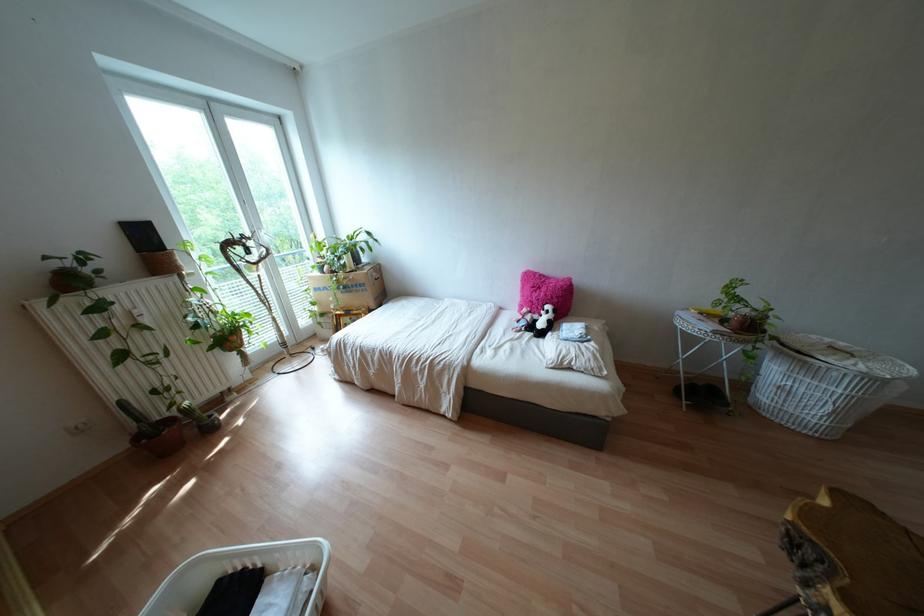
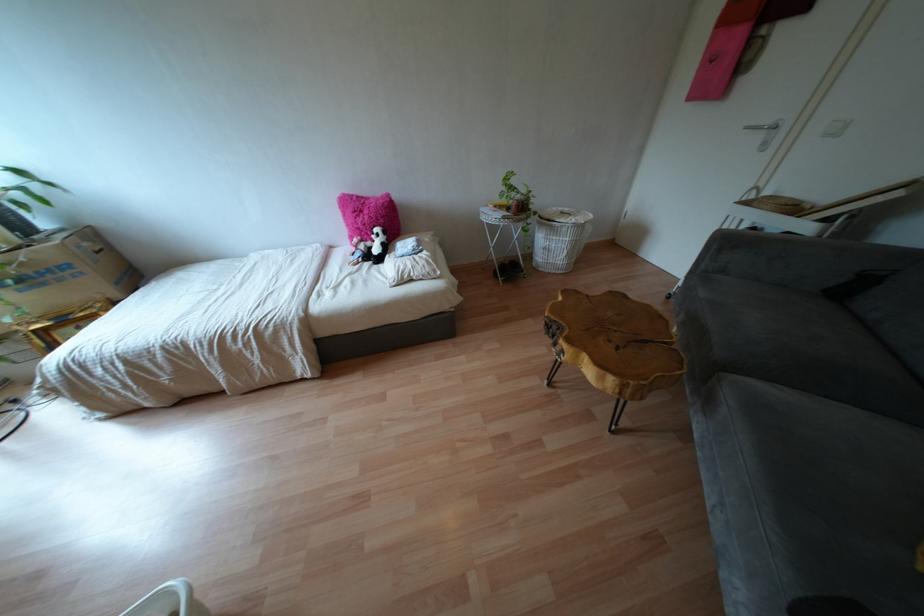
Where in the second image is the point corresponding to point 723,321 from the first image?

(506, 208)